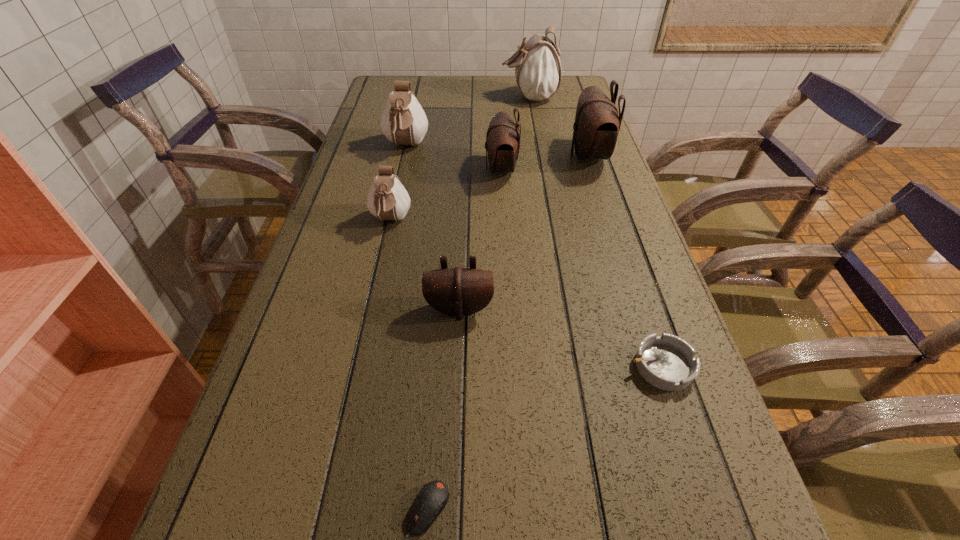
The image size is (960, 540). I want to click on the biggest white pouch, so pyautogui.click(x=537, y=65).

Image resolution: width=960 pixels, height=540 pixels. I want to click on the rightmost white pouch, so click(x=537, y=65).

At what (x,y) coordinates should I click in order to perform the action: click on the rightmost brown pouch. Please return your answer as a coordinate pair (x, y). The height and width of the screenshot is (540, 960). Looking at the image, I should click on (597, 124).

Find the location of a particular element. the second biggest white pouch is located at coordinates (404, 122).

The width and height of the screenshot is (960, 540). What are the coordinates of `the second biggest brown pouch` in the screenshot? It's located at (502, 145).

Identify the location of the second nearest pouch. (387, 199).

Locate an element on the screen. Image resolution: width=960 pixels, height=540 pixels. the nearest white pouch is located at coordinates (387, 199).

Where is `the smallest brown pouch`? The width and height of the screenshot is (960, 540). the smallest brown pouch is located at coordinates (458, 291).

Locate an element on the screen. The height and width of the screenshot is (540, 960). the sixth farthest object is located at coordinates (458, 291).

The image size is (960, 540). I want to click on the second nearest object, so click(667, 362).